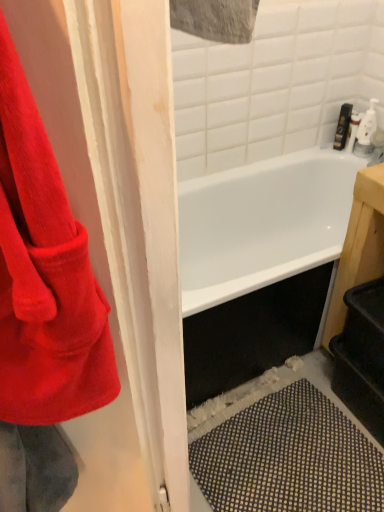
The width and height of the screenshot is (384, 512). What do you see at coordinates (44, 275) in the screenshot?
I see `corduroy red towel at left` at bounding box center [44, 275].

This screenshot has width=384, height=512. What are the coordinates of `corduroy red towel at left` in the screenshot? It's located at (44, 275).

The height and width of the screenshot is (512, 384). Describe the element at coordinates (342, 126) in the screenshot. I see `matte black soap dispenser at upper right` at that location.

At what (x,y) coordinates should I click in order to perform the action: click on matte black soap dispenser at upper right. Please return your answer as a coordinate pair (x, y). Image resolution: width=384 pixels, height=512 pixels. Looking at the image, I should click on (342, 126).

In order to click on corduroy red towel at left in this screenshot , I will do `click(44, 275)`.

Between corduroy red towel at left and matte black soap dispenser at upper right, which one appears on the left side from the viewer's perspective?

From the viewer's perspective, corduroy red towel at left appears more on the left side.

Which object is closer to the camera, corduroy red towel at left or matte black soap dispenser at upper right?

corduroy red towel at left.

Is point (54, 160) positioned behind point (341, 106)?

No.

From the image's perspective, is corduroy red towel at left beneath matte black soap dispenser at upper right?

Yes, from the image's perspective, corduroy red towel at left is below matte black soap dispenser at upper right.

From a real-world perspective, who is located higher, corduroy red towel at left or matte black soap dispenser at upper right?

From a 3D spatial view, corduroy red towel at left is above.

Does corduroy red towel at left have a greater width compared to matte black soap dispenser at upper right?

Indeed, corduroy red towel at left has a greater width compared to matte black soap dispenser at upper right.

Does corduroy red towel at left have a lesser height compared to matte black soap dispenser at upper right?

No.

Does corduroy red towel at left have a smaller size compared to matte black soap dispenser at upper right?

Incorrect, corduroy red towel at left is not smaller in size than matte black soap dispenser at upper right.

Would you say corduroy red towel at left is inside or outside matte black soap dispenser at upper right?

The correct answer is: outside.

Is corduroy red towel at left positioned far away from matte black soap dispenser at upper right?

Absolutely, corduroy red towel at left is distant from matte black soap dispenser at upper right.

Based on the photo, could you tell me if corduroy red towel at left is turned towards matte black soap dispenser at upper right?

No, corduroy red towel at left is not aimed at matte black soap dispenser at upper right.

From the picture: Can you tell me how much corduroy red towel at left and matte black soap dispenser at upper right differ in facing direction?

corduroy red towel at left and matte black soap dispenser at upper right are facing 62 degrees away from each other.

In the scene shown: Measure the distance between corduroy red towel at left and matte black soap dispenser at upper right.

They are 1.78 meters apart.

The height and width of the screenshot is (512, 384). In order to click on towel that appears in front of the matte black soap dispenser at upper right in this screenshot , I will do `click(44, 275)`.

Considering the positions of objects matte black soap dispenser at upper right and corduroy red towel at left in the image provided, who is more to the right, matte black soap dispenser at upper right or corduroy red towel at left?

Positioned to the right is matte black soap dispenser at upper right.

Which object is further away from the camera, matte black soap dispenser at upper right or corduroy red towel at left?

matte black soap dispenser at upper right is more distant.

Is point (345, 137) closer to viewer compared to point (7, 153)?

No, it is behind (7, 153).

From the image's perspective, does matte black soap dispenser at upper right appear lower than corduroy red towel at left?

Actually, matte black soap dispenser at upper right appears above corduroy red towel at left in the image.

From a real-world perspective, is matte black soap dispenser at upper right on top of corduroy red towel at left?

No, from a real-world perspective, matte black soap dispenser at upper right is not on top of corduroy red towel at left.

Can you confirm if matte black soap dispenser at upper right is thinner than corduroy red towel at left?

Correct, the width of matte black soap dispenser at upper right is less than that of corduroy red towel at left.

Between matte black soap dispenser at upper right and corduroy red towel at left, which one has less height?

With less height is matte black soap dispenser at upper right.

In terms of size, does matte black soap dispenser at upper right appear bigger or smaller than corduroy red towel at left?

In the image, matte black soap dispenser at upper right appears to be smaller than corduroy red towel at left.

Could corduroy red towel at left be considered to be inside matte black soap dispenser at upper right?

No.

Are matte black soap dispenser at upper right and corduroy red towel at left beside each other?

No.

Is matte black soap dispenser at upper right facing away from corduroy red towel at left?

No, matte black soap dispenser at upper right's orientation is not away from corduroy red towel at left.

Can you tell me how much matte black soap dispenser at upper right and corduroy red towel at left differ in facing direction?

They differ by 62 degrees in their facing directions.

Where is `towel that is below the matte black soap dispenser at upper right (from the image's perspective)`? This screenshot has height=512, width=384. towel that is below the matte black soap dispenser at upper right (from the image's perspective) is located at coordinates (44, 275).

Find the location of a particular element. toiletry behind the corduroy red towel at left is located at coordinates (342, 126).

Where is `toiletry to the right of corduroy red towel at left`? The width and height of the screenshot is (384, 512). toiletry to the right of corduroy red towel at left is located at coordinates (342, 126).